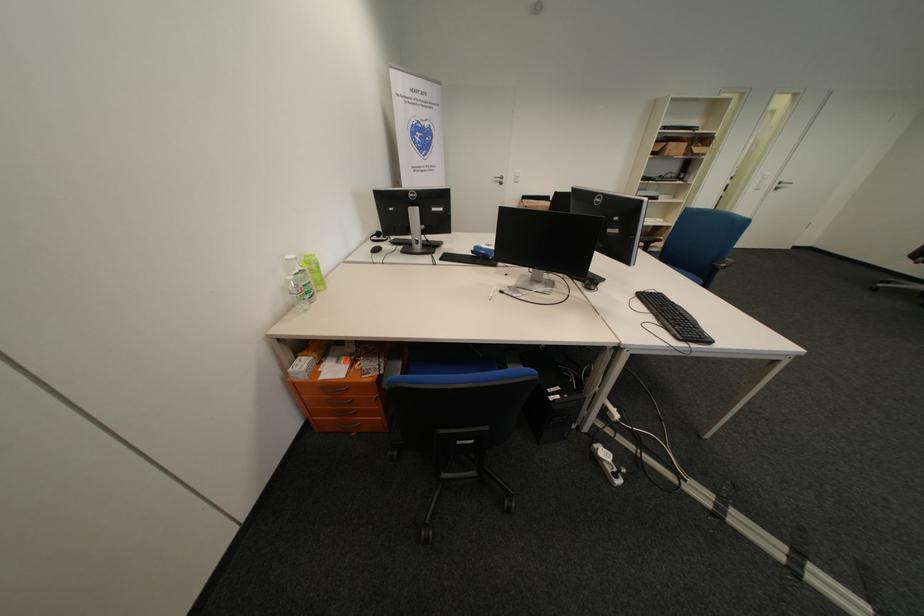
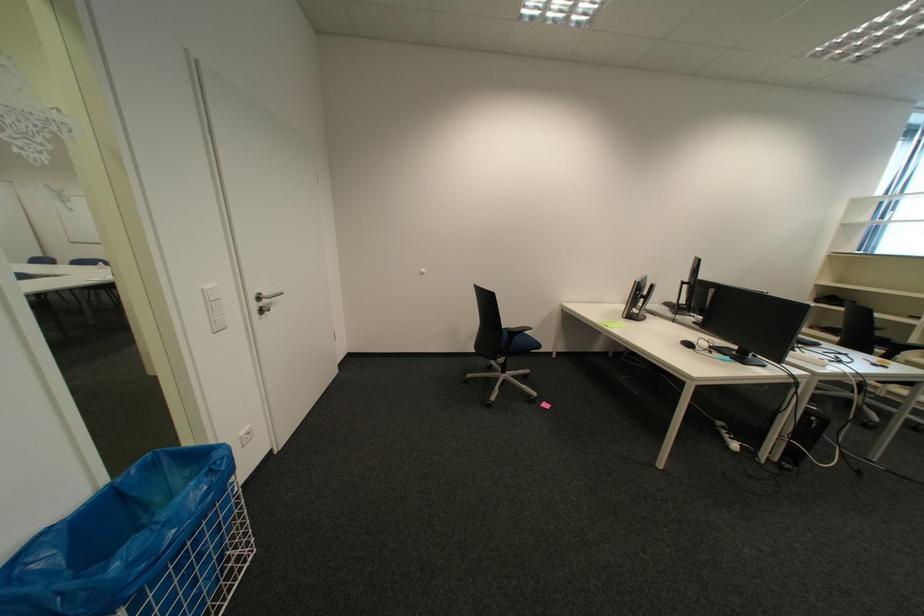
Locate, in the second image, the point that corresponds to (787,187) in the first image.

(266, 307)